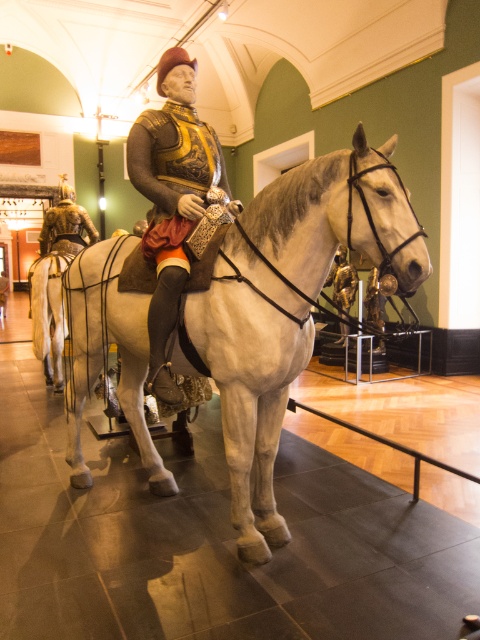
Image resolution: width=480 pixels, height=640 pixels. What do you see at coordinates (289, 307) in the screenshot?
I see `white glossy horse at center` at bounding box center [289, 307].

The width and height of the screenshot is (480, 640). What are the coordinates of `white glossy horse at center` in the screenshot? It's located at (289, 307).